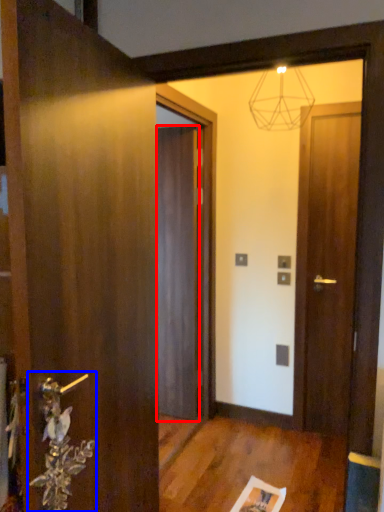
Question: Which object appears farthest to the camera in this image, door (highlighted by a red box) or door handle (highlighted by a blue box)?

Choices:
 (A) door
 (B) door handle

Answer: (A)